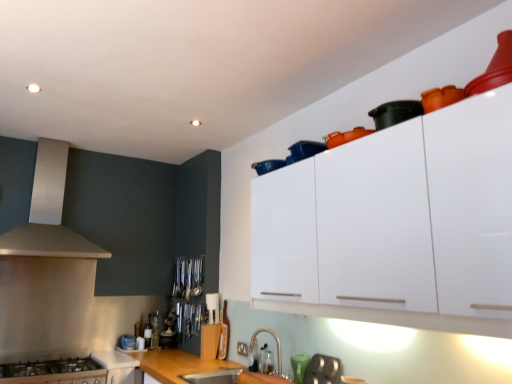
Question: Is satin nickel faucet at lower center smaller than stainless steel stove at lower left, the second cabinetry positioned from the top?

Choices:
 (A) no
 (B) yes

Answer: (B)

Question: Could stainless steel stove at lower left, the second cabinetry positioned from the top, be considered to be inside satin nickel faucet at lower center?

Choices:
 (A) yes
 (B) no

Answer: (B)

Question: Is satin nickel faucet at lower center positioned before stainless steel stove at lower left, the second cabinetry positioned from the top?

Choices:
 (A) no
 (B) yes

Answer: (B)

Question: From the image's perspective, does satin nickel faucet at lower center appear lower than stainless steel stove at lower left, which is the second cabinetry from front to back?

Choices:
 (A) no
 (B) yes

Answer: (A)

Question: From a real-world perspective, is satin nickel faucet at lower center located beneath stainless steel stove at lower left, positioned as the 2th cabinetry in right-to-left order?

Choices:
 (A) no
 (B) yes

Answer: (A)

Question: From the image's perspective, is satin nickel faucet at lower center over stainless steel stove at lower left, which is the second cabinetry from front to back?

Choices:
 (A) yes
 (B) no

Answer: (A)

Question: Is the position of satin nickel faucet at lower center more distant than that of metallic silver utensils at center, the first appliance in the back-to-front sequence?

Choices:
 (A) yes
 (B) no

Answer: (B)

Question: From a real-world perspective, does satin nickel faucet at lower center sit lower than metallic silver utensils at center, the 4th appliance positioned from the front?

Choices:
 (A) yes
 (B) no

Answer: (A)

Question: Would you say satin nickel faucet at lower center contains metallic silver utensils at center, arranged as the fourth appliance when viewed from the right?

Choices:
 (A) no
 (B) yes

Answer: (A)

Question: Is satin nickel faucet at lower center at the right side of metallic silver utensils at center, arranged as the fourth appliance when viewed from the right?

Choices:
 (A) no
 (B) yes

Answer: (B)

Question: From the image's perspective, would you say satin nickel faucet at lower center is shown under metallic silver utensils at center, arranged as the 2th appliance when ordered from the bottom?

Choices:
 (A) yes
 (B) no

Answer: (A)

Question: Considering the relative sizes of satin nickel faucet at lower center and metallic silver utensils at center, placed as the first appliance when sorted from left to right, in the image provided, is satin nickel faucet at lower center taller than metallic silver utensils at center, placed as the first appliance when sorted from left to right,?

Choices:
 (A) no
 (B) yes

Answer: (A)

Question: Considering the relative sizes of teal glass at lower center and satin nickel faucet at lower center in the image provided, is teal glass at lower center smaller than satin nickel faucet at lower center?

Choices:
 (A) yes
 (B) no

Answer: (A)